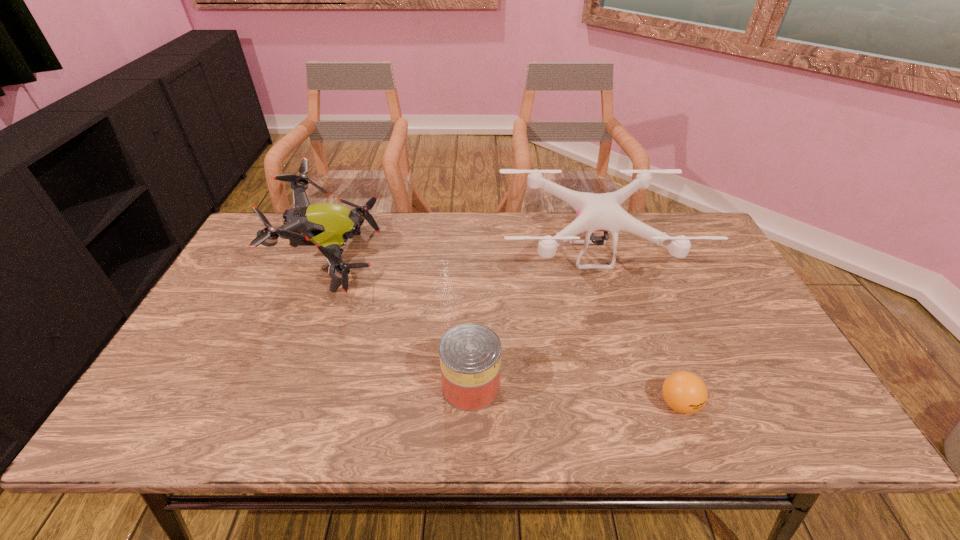
Identify the location of the leftmost object. The width and height of the screenshot is (960, 540). (328, 226).

The height and width of the screenshot is (540, 960). Identify the location of the tallest object. [x=328, y=226].

The height and width of the screenshot is (540, 960). I want to click on the third shortest object, so click(595, 212).

In order to click on the right drone in this screenshot , I will do `click(595, 212)`.

You are a GUI agent. You are given a task and a screenshot of the screen. Output one action in this format:
    pyautogui.click(x=<x>, y=<y>)
    Task: Click on the second shortest object
    The width and height of the screenshot is (960, 540).
    Given the screenshot: What is the action you would take?
    (x=470, y=354)

You are a GUI agent. You are given a task and a screenshot of the screen. Output one action in this format:
    pyautogui.click(x=<x>, y=<y>)
    Task: Click on the can
    
    Given the screenshot: What is the action you would take?
    (470, 354)

This screenshot has width=960, height=540. In order to click on ping-pong ball in this screenshot , I will do `click(684, 392)`.

Locate an element on the screen. This screenshot has height=540, width=960. free space located 0.110m on the front-facing side of the taller drone is located at coordinates (414, 259).

You are a GUI agent. You are given a task and a screenshot of the screen. Output one action in this format:
    pyautogui.click(x=<x>, y=<y>)
    Task: Click on the blank space located 0.170m on the top of the right drone
    
    Given the screenshot: What is the action you would take?
    tap(618, 347)

This screenshot has height=540, width=960. I want to click on blank space located on the right of the second object from left to right, so [x=530, y=386].